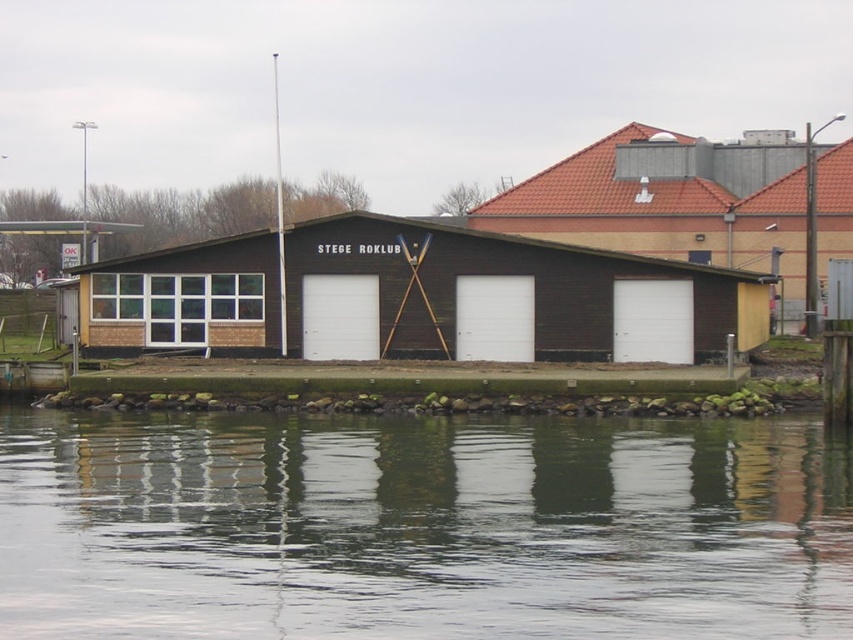
Question: Which of the following is the closest to the observer?

Choices:
 (A) (154, 285)
 (B) (804, 428)

Answer: (B)

Question: Does transparent water at lower center have a smaller size compared to brown wooden dock at center?

Choices:
 (A) yes
 (B) no

Answer: (A)

Question: Is transparent water at lower center to the right of brown wooden dock at center from the viewer's perspective?

Choices:
 (A) no
 (B) yes

Answer: (A)

Question: Which point appears farthest from the camera in this image?

Choices:
 (A) (619, 481)
 (B) (247, 289)

Answer: (B)

Question: Where is transparent water at lower center located in relation to brown wooden dock at center in the image?

Choices:
 (A) left
 (B) right

Answer: (A)